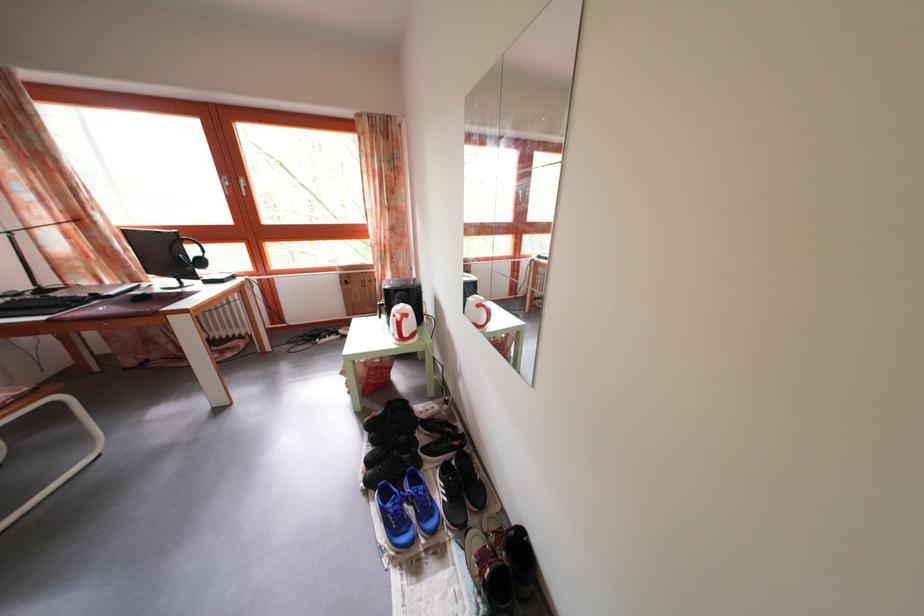
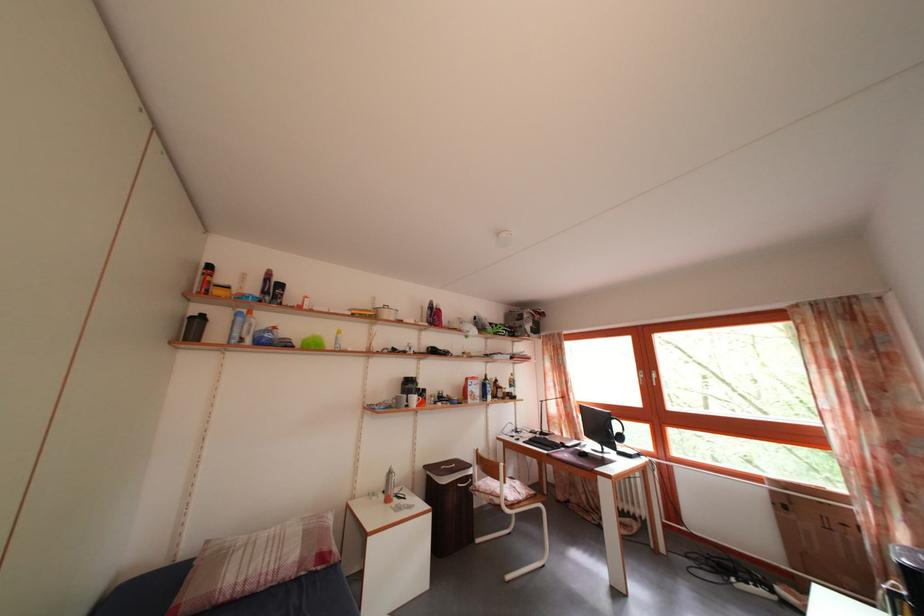
Locate, in the second image, the point that corresponds to pixel 200 257 in the first image.

(624, 434)